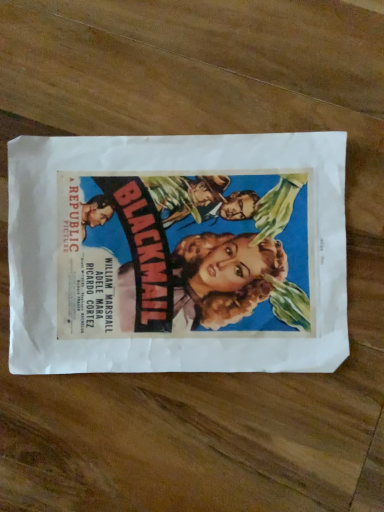
The image size is (384, 512). What do you see at coordinates (177, 253) in the screenshot?
I see `matte paper poster at center` at bounding box center [177, 253].

At what (x,y) coordinates should I click in order to perform the action: click on matte paper poster at center. Please return your answer as a coordinate pair (x, y). Looking at the image, I should click on (177, 253).

Locate an element on the screen. This screenshot has height=512, width=384. matte paper poster at center is located at coordinates (177, 253).